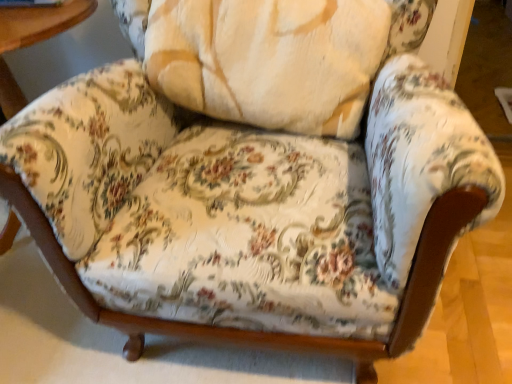
This screenshot has width=512, height=384. What do you see at coordinates (269, 60) in the screenshot?
I see `fluffy white pillow at upper center` at bounding box center [269, 60].

At what (x,y) coordinates should I click in order to perform the action: click on fluffy white pillow at upper center. Please return your answer as a coordinate pair (x, y). Looking at the image, I should click on (269, 60).

The width and height of the screenshot is (512, 384). What are the coordinates of `fluffy white pillow at upper center` in the screenshot? It's located at (269, 60).